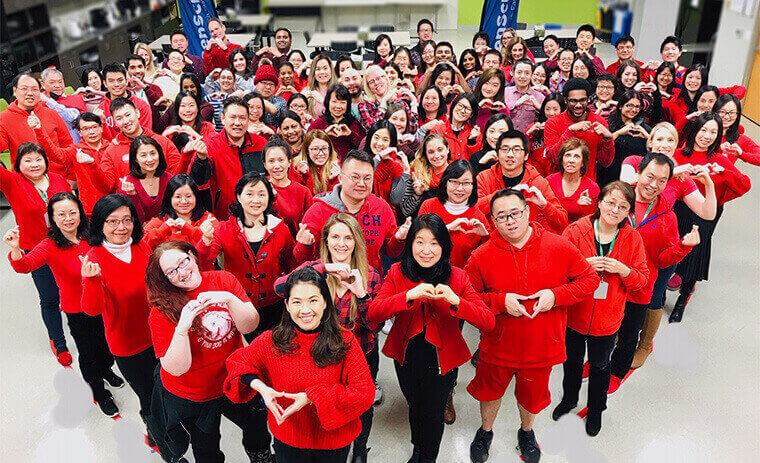
At what (x,y) coordinates should I click in order to perform the action: click on tables in background. Please return your answer as a coordinate pair (x, y). The height and width of the screenshot is (463, 760). Looking at the image, I should click on (245, 17), (241, 38), (344, 34), (553, 30).